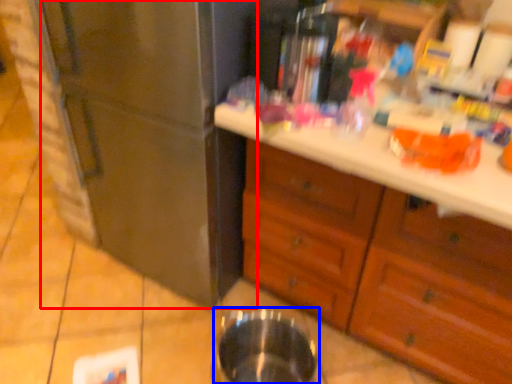
Question: Among these objects, which one is farthest to the camera, refrigerator (highlighted by a red box) or basin (highlighted by a blue box)?

Choices:
 (A) refrigerator
 (B) basin

Answer: (B)